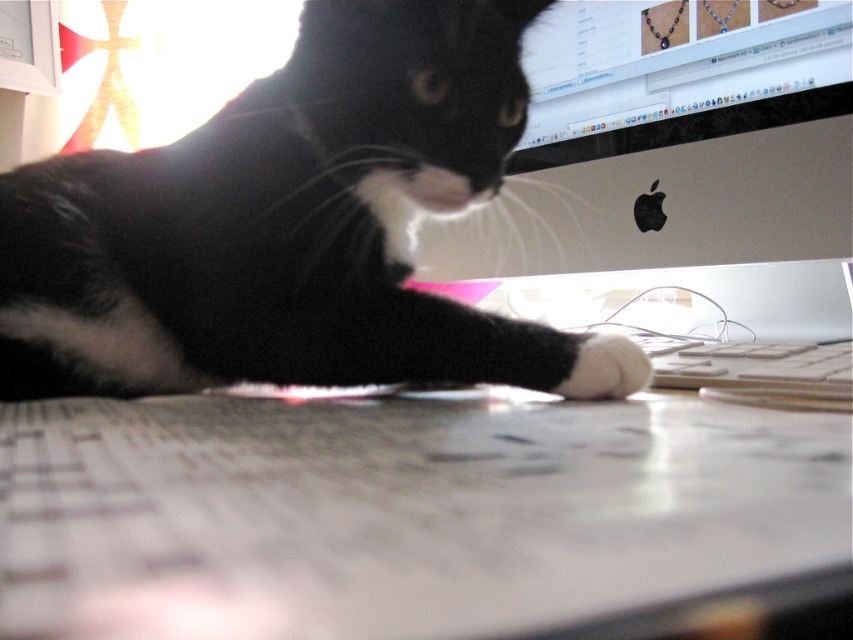
Who is taller, black fur cat at center or white plastic keyboard at right?

Standing taller between the two is black fur cat at center.

Based on the photo, does black fur cat at center have a larger size compared to white plastic keyboard at right?

Indeed, black fur cat at center has a larger size compared to white plastic keyboard at right.

Locate an element on the screen. The image size is (853, 640). black fur cat at center is located at coordinates (281, 224).

Where is `black fur cat at center`? black fur cat at center is located at coordinates (281, 224).

Who is taller, white plastic keyboard at right or white soft paw at center?

Standing taller between the two is white soft paw at center.

Is white plastic keyboard at right to the left of white soft paw at center from the viewer's perspective?

Incorrect, white plastic keyboard at right is not on the left side of white soft paw at center.

Is point (653, 339) more distant than point (607, 340)?

Yes.

This screenshot has width=853, height=640. I want to click on white plastic keyboard at right, so click(x=753, y=369).

Is point (317, 404) less distant than point (41, 284)?

That is True.

I want to click on white glossy desk at center, so click(402, 513).

Describe the element at coordinates (402, 513) in the screenshot. The image size is (853, 640). I see `white glossy desk at center` at that location.

Locate an element on the screen. The height and width of the screenshot is (640, 853). white glossy desk at center is located at coordinates (402, 513).